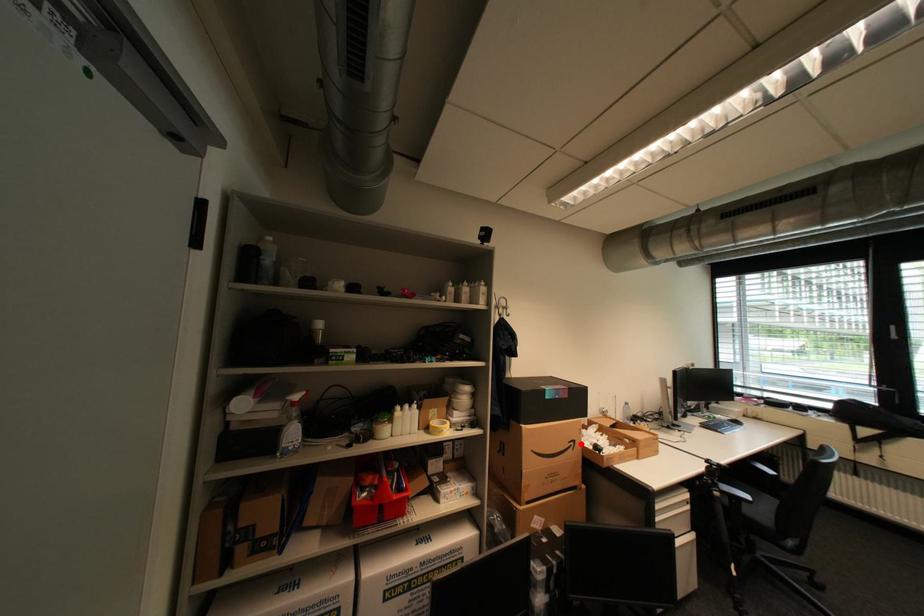
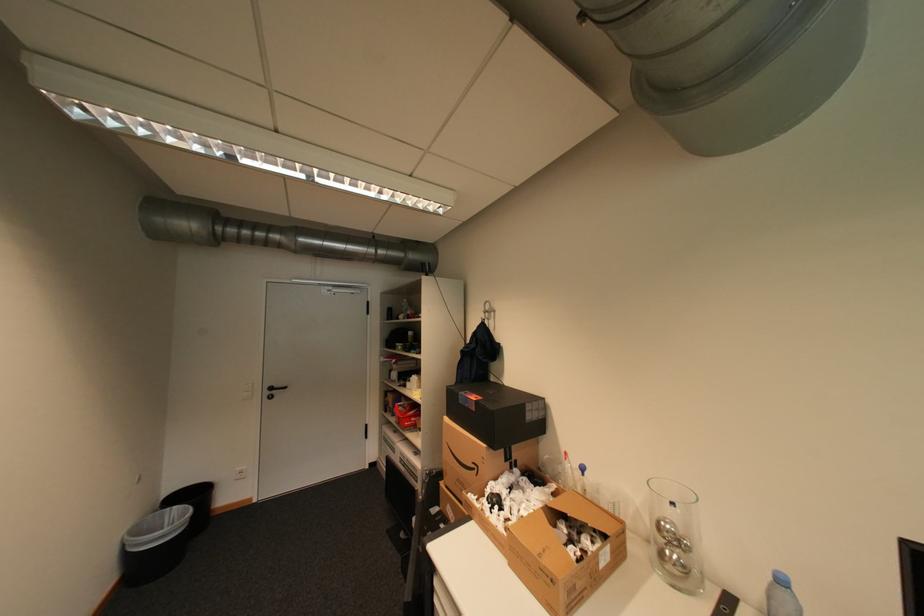
Locate, in the second image, the point that corresponds to the highlighted location in the first image.

(484, 468)